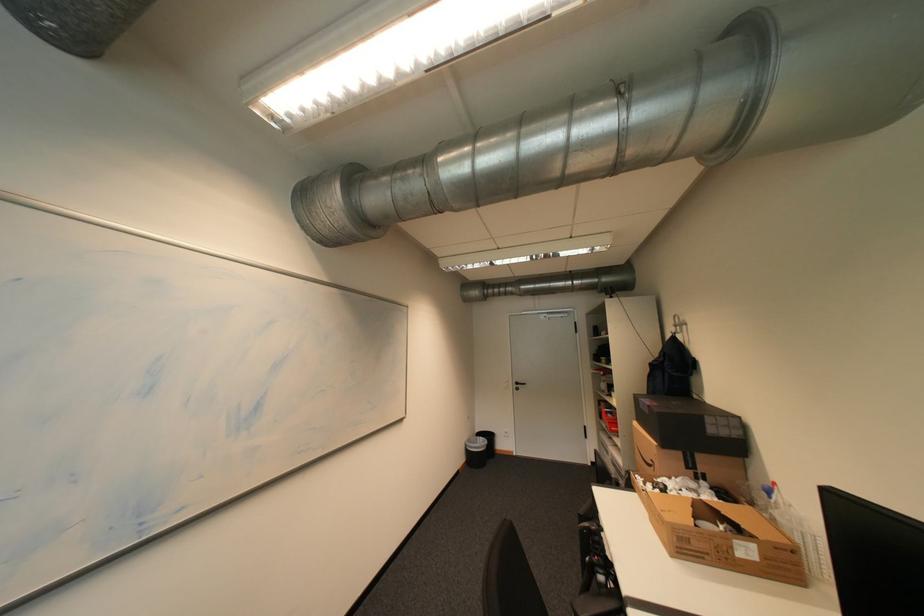
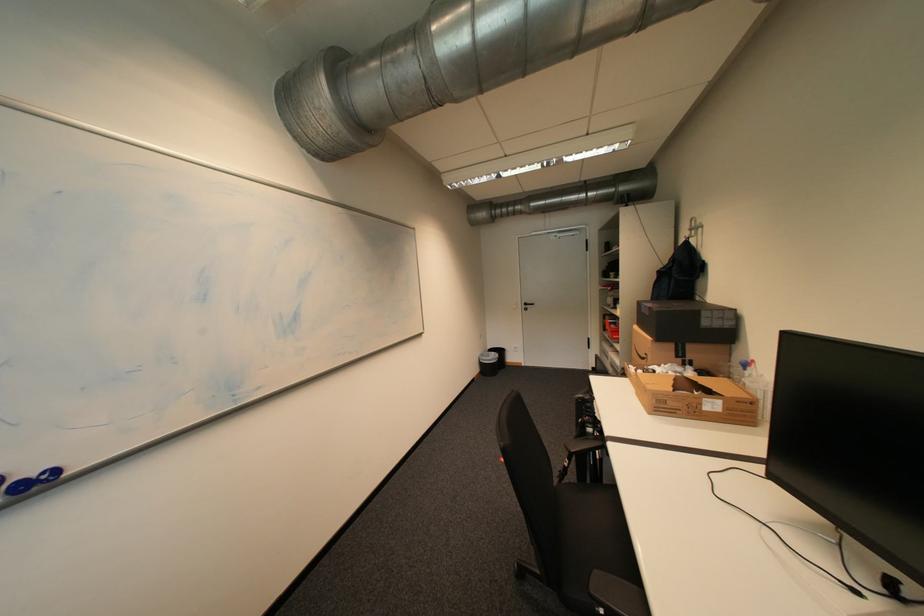
Question: Which direction would the cameraman need to move to produce the second image? Reply with the corresponding letter.

Choices:
 (A) Left
 (B) Right
 (C) Forward
 (D) Backward

Answer: (D)